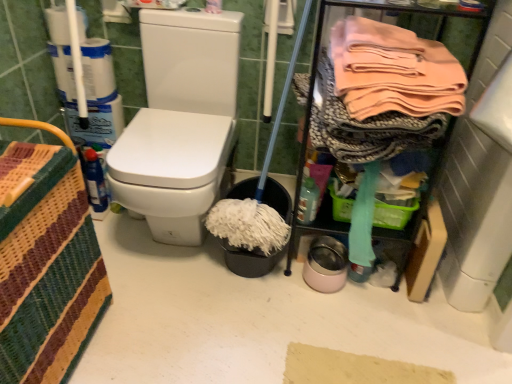
Question: Can you confirm if translucent plastic bottle at lower right is shorter than pink fabric at upper right?

Choices:
 (A) no
 (B) yes

Answer: (B)

Question: From a real-world perspective, is translucent plastic bottle at lower right positioned under pink fabric at upper right based on gravity?

Choices:
 (A) no
 (B) yes

Answer: (B)

Question: Can we say translucent plastic bottle at lower right lies outside pink fabric at upper right?

Choices:
 (A) yes
 (B) no

Answer: (A)

Question: Is the position of translucent plastic bottle at lower right more distant than that of pink fabric at upper right?

Choices:
 (A) no
 (B) yes

Answer: (B)

Question: Considering the relative sizes of translucent plastic bottle at lower right and pink fabric at upper right in the image provided, is translucent plastic bottle at lower right smaller than pink fabric at upper right?

Choices:
 (A) yes
 (B) no

Answer: (A)

Question: From a real-world perspective, is pink fabric at upper right above or below woven fabric basket at left?

Choices:
 (A) below
 (B) above

Answer: (B)

Question: Is pink fabric at upper right to the left or to the right of woven fabric basket at left in the image?

Choices:
 (A) right
 (B) left

Answer: (A)

Question: Relative to woven fabric basket at left, is pink fabric at upper right in front or behind?

Choices:
 (A) front
 (B) behind

Answer: (B)

Question: Is pink fabric at upper right inside or outside of woven fabric basket at left?

Choices:
 (A) outside
 (B) inside

Answer: (A)

Question: Based on their positions, is woven fabric basket at left located to the left or right of pink fabric at upper right?

Choices:
 (A) left
 (B) right

Answer: (A)

Question: From a real-world perspective, is woven fabric basket at left positioned above or below pink fabric at upper right?

Choices:
 (A) below
 (B) above

Answer: (A)

Question: From the image's perspective, is woven fabric basket at left above or below pink fabric at upper right?

Choices:
 (A) below
 (B) above

Answer: (A)

Question: Which is correct: woven fabric basket at left is inside pink fabric at upper right, or outside of it?

Choices:
 (A) inside
 (B) outside

Answer: (B)

Question: From a real-world perspective, relative to pink fabric at upper right, is translucent plastic bottle at lower right vertically above or below?

Choices:
 (A) below
 (B) above

Answer: (A)

Question: Based on their positions, is translucent plastic bottle at lower right located to the left or right of pink fabric at upper right?

Choices:
 (A) right
 (B) left

Answer: (B)